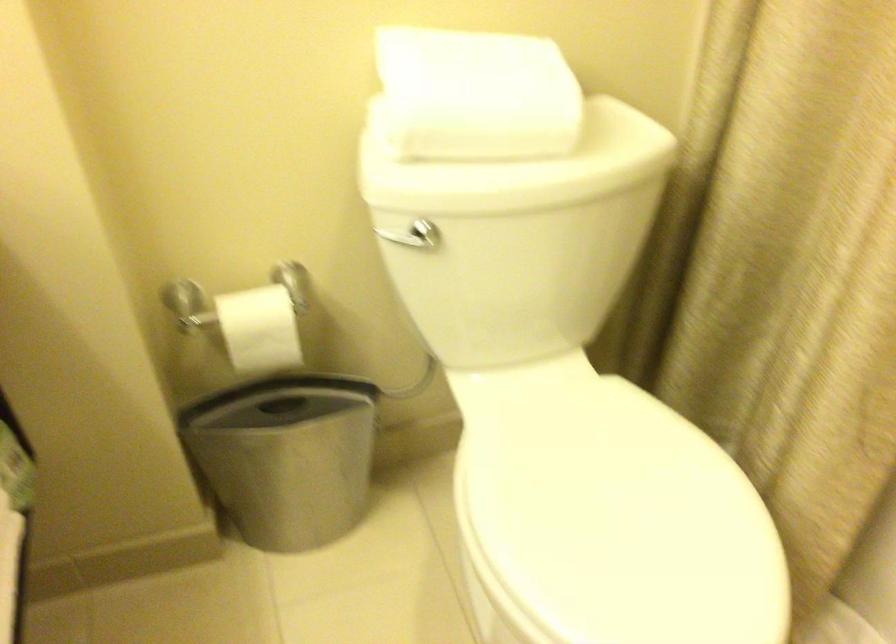
The location [286,456] corresponds to which object?

It refers to a silver trash can.